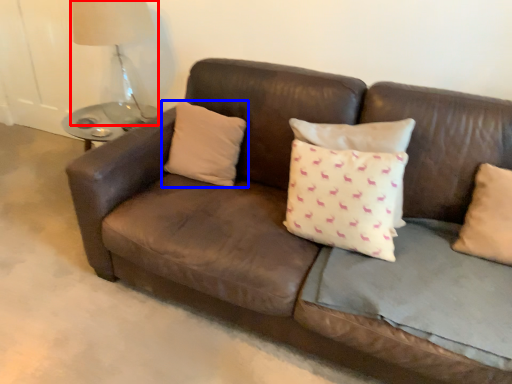
Question: Which object appears farthest to the camera in this image, table lamp (highlighted by a red box) or pillow (highlighted by a blue box)?

Choices:
 (A) table lamp
 (B) pillow

Answer: (A)